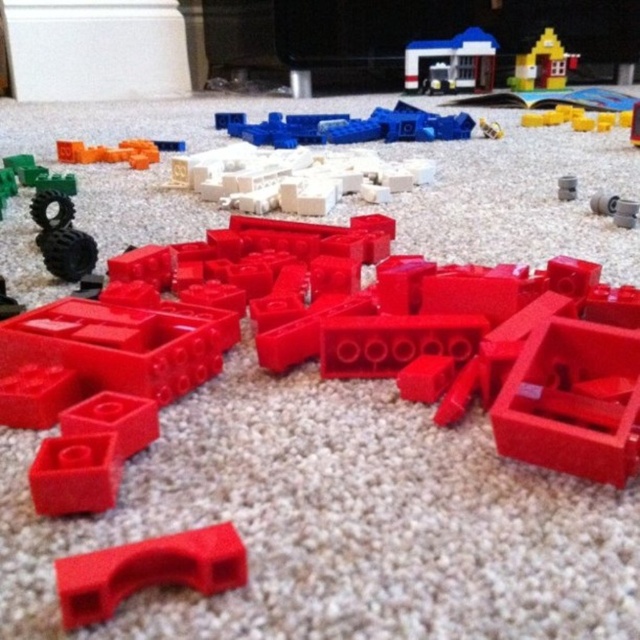
Question: Which point is closer to the camera?

Choices:
 (A) translucent orange plastic blocks at upper left
 (B) matte plastic house at upper right
 (C) translucent blue plastic building at upper center

Answer: (A)

Question: Does matte plastic arch at center have a greater width compared to matte blue bricks at center?

Choices:
 (A) yes
 (B) no

Answer: (B)

Question: Can you confirm if translucent blue plastic building at upper center is smaller than matte plastic house at upper right?

Choices:
 (A) yes
 (B) no

Answer: (B)

Question: Which point appears farthest from the camera in this image?

Choices:
 (A) (636, 115)
 (B) (177, 536)
 (C) (449, 132)

Answer: (C)

Question: Which of the following is the closest to the observer?

Choices:
 (A) translucent orange plastic blocks at upper left
 (B) matte plastic house at upper right

Answer: (A)

Question: Is the position of matte blue bricks at center less distant than that of translucent blue plastic building at upper center?

Choices:
 (A) no
 (B) yes

Answer: (B)